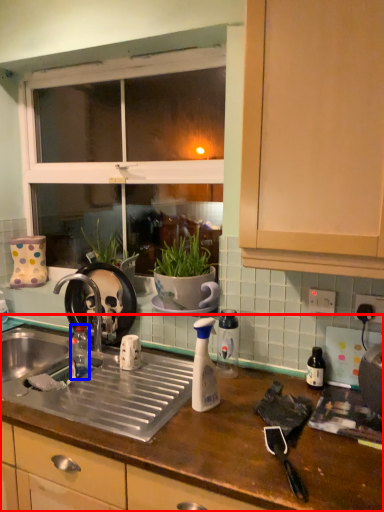
Question: Which object appears closest to the camera in this image, countertop (highlighted by a red box) or bottle (highlighted by a blue box)?

Choices:
 (A) countertop
 (B) bottle

Answer: (A)